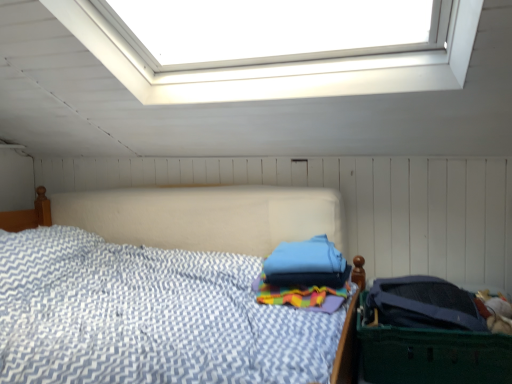
Question: Is blue fabric pillow at center looking in the opposite direction of dark green plastic laundry basket at right?

Choices:
 (A) no
 (B) yes

Answer: (A)

Question: Can you confirm if blue fabric pillow at center is shorter than dark green plastic laundry basket at right?

Choices:
 (A) yes
 (B) no

Answer: (A)

Question: Is blue fabric pillow at center at the right side of dark green plastic laundry basket at right?

Choices:
 (A) no
 (B) yes

Answer: (A)

Question: Can you confirm if blue fabric pillow at center is thinner than dark green plastic laundry basket at right?

Choices:
 (A) no
 (B) yes

Answer: (B)

Question: Is blue fabric pillow at center oriented towards dark green plastic laundry basket at right?

Choices:
 (A) yes
 (B) no

Answer: (B)

Question: Is blue fabric pillow at center completely or partially outside of dark green plastic laundry basket at right?

Choices:
 (A) no
 (B) yes

Answer: (B)

Question: Could you tell me if dark green plastic laundry basket at right is facing blue fabric pillow at center?

Choices:
 (A) no
 (B) yes

Answer: (A)

Question: Can we say dark green plastic laundry basket at right lies outside blue fabric pillow at center?

Choices:
 (A) no
 (B) yes

Answer: (B)

Question: From a real-world perspective, is dark green plastic laundry basket at right positioned over blue fabric pillow at center based on gravity?

Choices:
 (A) no
 (B) yes

Answer: (A)

Question: Considering the relative sizes of dark green plastic laundry basket at right and blue fabric pillow at center in the image provided, is dark green plastic laundry basket at right thinner than blue fabric pillow at center?

Choices:
 (A) yes
 (B) no

Answer: (B)

Question: Is dark green plastic laundry basket at right at the left side of blue fabric pillow at center?

Choices:
 (A) yes
 (B) no

Answer: (B)

Question: From the image's perspective, does dark green plastic laundry basket at right appear higher than blue fabric pillow at center?

Choices:
 (A) no
 (B) yes

Answer: (A)

Question: Is point (347, 276) positioned closer to the camera than point (497, 377)?

Choices:
 (A) closer
 (B) farther

Answer: (B)